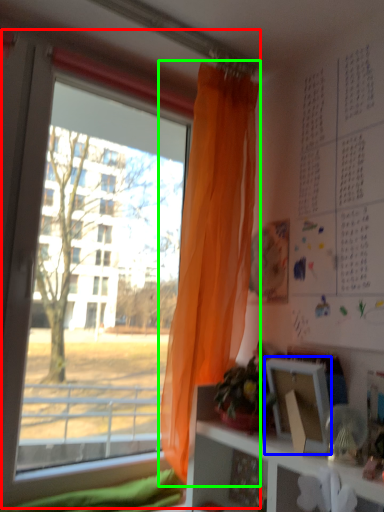
Question: Which object is the closest to the window (highlighted by a red box)? Choose among these: picture frame (highlighted by a blue box) or curtain (highlighted by a green box).

Choices:
 (A) picture frame
 (B) curtain

Answer: (B)